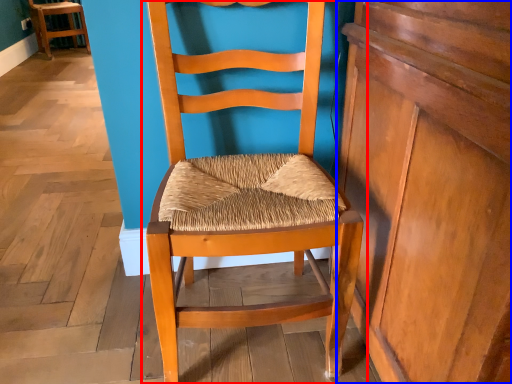
Question: Which point is further to the camera, chair (highlighted by a red box) or dresser (highlighted by a blue box)?

Choices:
 (A) chair
 (B) dresser

Answer: (A)